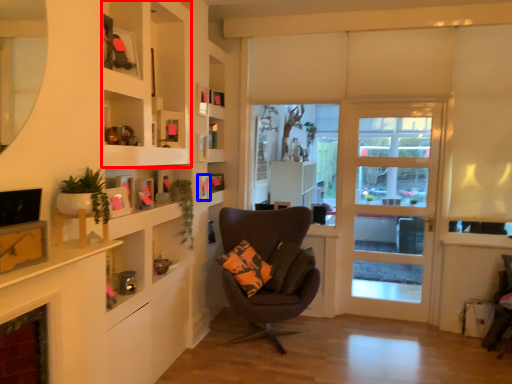
Question: Which object appears farthest to the camera in this image, cabinet (highlighted by a red box) or picture frame (highlighted by a blue box)?

Choices:
 (A) cabinet
 (B) picture frame

Answer: (B)